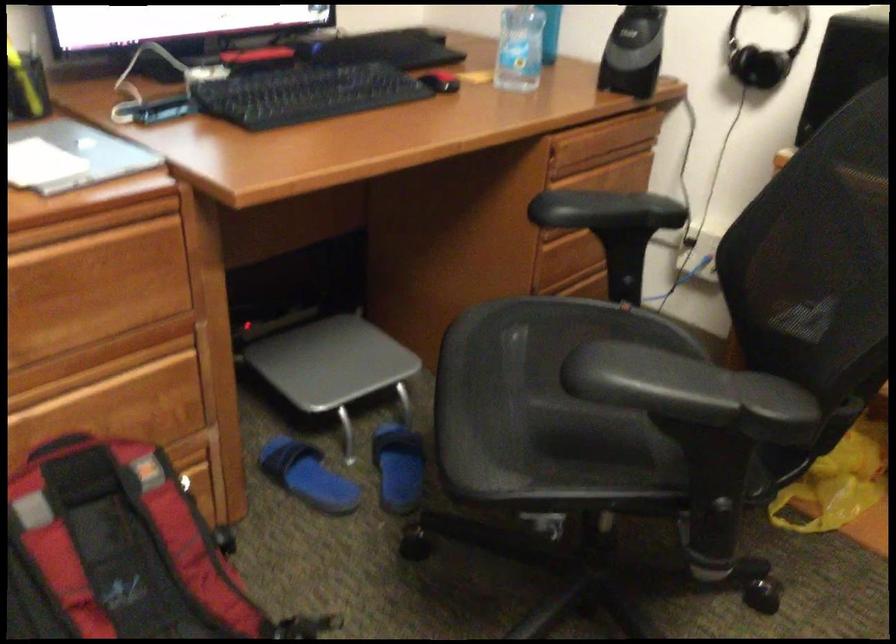
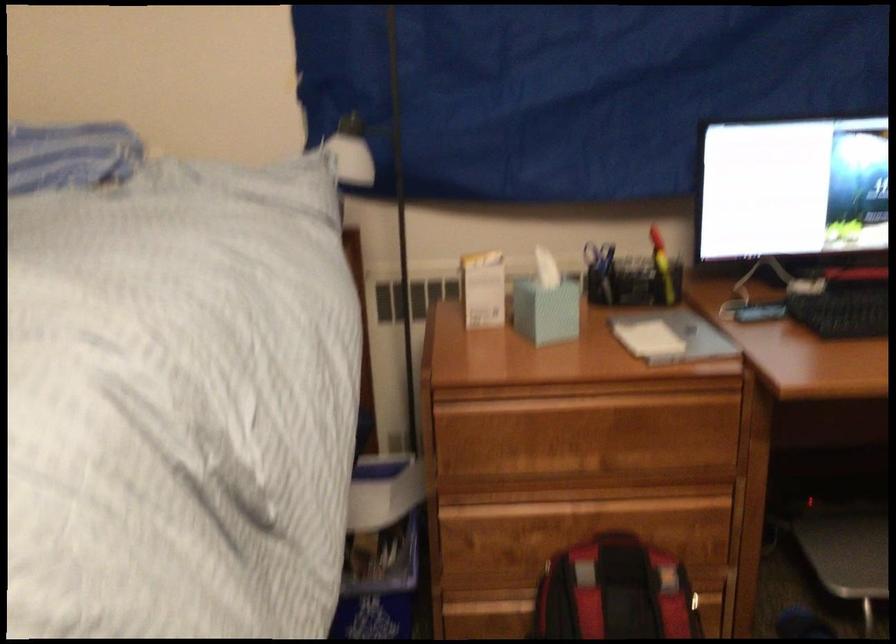
Question: I am providing you with two images of the same scene from different viewpoints. Which of the following objects are not visible in image2?

Choices:
 (A) small cardboard box
 (B) yellow highlighter
 (C) white lamp shade
 (D) none of these

Answer: (D)